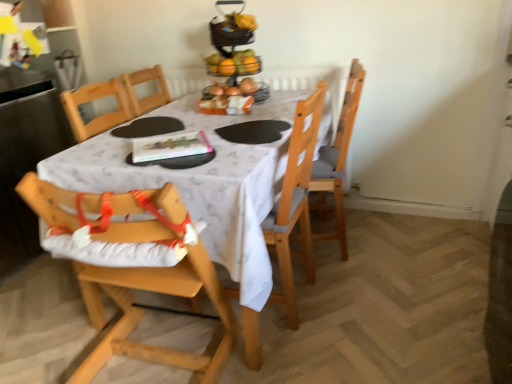
Where is `free space to the right of wooden chair at center, acting as the 2th chair starting from the left`? Image resolution: width=512 pixels, height=384 pixels. free space to the right of wooden chair at center, acting as the 2th chair starting from the left is located at coordinates (362, 299).